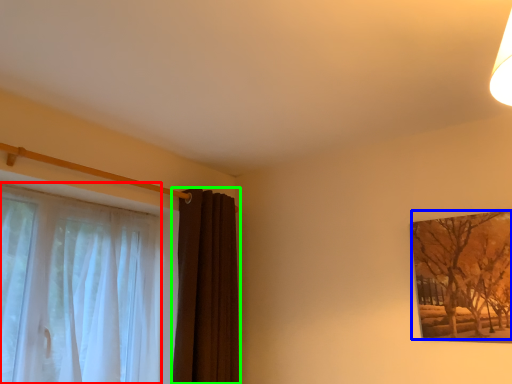
Question: Which object is positioned farthest from curtain (highlighted by a red box)? Select from tree (highlighted by a blue box) and curtain (highlighted by a green box).

Choices:
 (A) tree
 (B) curtain

Answer: (A)